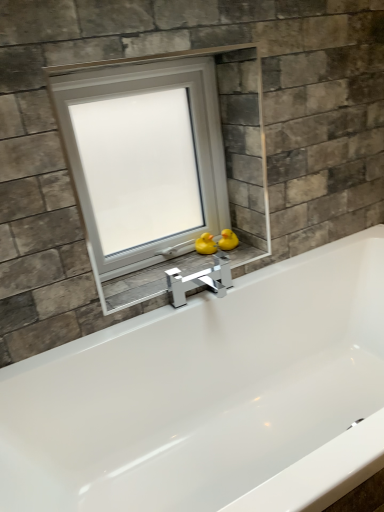
Locate an element on the screen. The height and width of the screenshot is (512, 384). white plastic window at center is located at coordinates (145, 160).

What is the approximate height of yellow rubber duck at center, acting as the 2th duck starting from the left?

yellow rubber duck at center, acting as the 2th duck starting from the left, is 3.41 inches tall.

What are the coordinates of `white plastic window at center` in the screenshot? It's located at (145, 160).

From a real-world perspective, starting from the matte gray stone at center, which duck is the 1st one vertically above it? Please provide its 2D coordinates.

[(206, 244)]

Can yellow rubber duck at center, acting as the 1th duck starting from the left, be found inside matte gray stone at center?

No, yellow rubber duck at center, acting as the 1th duck starting from the left, is not a part of matte gray stone at center.

Does matte gray stone at center come in front of yellow rubber duck at center, which is the 2th duck from right to left?

Yes, the depth of matte gray stone at center is less than that of yellow rubber duck at center, which is the 2th duck from right to left.

From a real-world perspective, which is physically above, matte gray stone at center or yellow rubber duck at center, acting as the 1th duck starting from the left?

yellow rubber duck at center, acting as the 1th duck starting from the left, from a real-world perspective.

From the image's perspective, is yellow rubber duck at center, which is the 2th duck from right to left, on white plastic window at center?

No, from the image's perspective, yellow rubber duck at center, which is the 2th duck from right to left, is not over white plastic window at center.

Considering the positions of objects yellow rubber duck at center, which is the 2th duck from right to left, and white plastic window at center in the image provided, who is in front, yellow rubber duck at center, which is the 2th duck from right to left, or white plastic window at center?

white plastic window at center is in front.

Which object is positioned more to the left, yellow rubber duck at center, acting as the 1th duck starting from the left, or white plastic window at center?

Positioned to the left is white plastic window at center.

Is yellow rubber duck at center, which is the 2th duck from right to left, bigger than white plastic window at center?

No.

Is white plastic window at center shorter than matte gray stone at center?

Incorrect, the height of white plastic window at center does not fall short of that of matte gray stone at center.

Could you tell me if white plastic window at center is turned towards matte gray stone at center?

Yes, white plastic window at center is oriented towards matte gray stone at center.

Is white plastic window at center at the left side of matte gray stone at center?

Yes, white plastic window at center is to the left of matte gray stone at center.

Does yellow rubber duck at center, the first duck viewed from the right, have a smaller size compared to yellow rubber duck at center, which is the 2th duck from right to left?

Actually, yellow rubber duck at center, the first duck viewed from the right, might be larger than yellow rubber duck at center, which is the 2th duck from right to left.

Can you see yellow rubber duck at center, acting as the 2th duck starting from the left, touching yellow rubber duck at center, which is the 2th duck from right to left?

Yes, yellow rubber duck at center, acting as the 2th duck starting from the left, is beside yellow rubber duck at center, which is the 2th duck from right to left.

Which of these two, yellow rubber duck at center, the first duck viewed from the right, or yellow rubber duck at center, which is the 2th duck from right to left, stands shorter?

yellow rubber duck at center, the first duck viewed from the right.

The width and height of the screenshot is (384, 512). Identify the location of duck that is above the yellow rubber duck at center, acting as the 1th duck starting from the left (from a real-world perspective). coord(228,240).

Is white plastic window at center situated inside yellow rubber duck at center, acting as the 1th duck starting from the left, or outside?

white plastic window at center lies outside yellow rubber duck at center, acting as the 1th duck starting from the left.

Considering the positions of objects white plastic window at center and yellow rubber duck at center, which is the 2th duck from right to left, in the image provided, who is more to the left, white plastic window at center or yellow rubber duck at center, which is the 2th duck from right to left,?

white plastic window at center.

Is white plastic window at center bigger than yellow rubber duck at center, which is the 2th duck from right to left?

Yes.

Can you confirm if white plastic window at center is thinner than yellow rubber duck at center, acting as the 1th duck starting from the left?

In fact, white plastic window at center might be wider than yellow rubber duck at center, acting as the 1th duck starting from the left.

From the image's perspective, relative to yellow rubber duck at center, the first duck viewed from the right, is yellow rubber duck at center, acting as the 1th duck starting from the left, above or below?

Based on their image positions, yellow rubber duck at center, acting as the 1th duck starting from the left, is located beneath yellow rubber duck at center, the first duck viewed from the right.

Considering the sizes of yellow rubber duck at center, which is the 2th duck from right to left, and yellow rubber duck at center, the first duck viewed from the right, in the image, is yellow rubber duck at center, which is the 2th duck from right to left, taller or shorter than yellow rubber duck at center, the first duck viewed from the right,?

yellow rubber duck at center, which is the 2th duck from right to left, is taller than yellow rubber duck at center, the first duck viewed from the right.

Is point (205, 242) behind point (227, 244)?

Yes, it is.

Can you confirm if yellow rubber duck at center, acting as the 1th duck starting from the left, is positioned to the right of yellow rubber duck at center, acting as the 2th duck starting from the left?

No, yellow rubber duck at center, acting as the 1th duck starting from the left, is not to the right of yellow rubber duck at center, acting as the 2th duck starting from the left.

Does yellow rubber duck at center, which is the 2th duck from right to left, touch matte gray stone at center?

No.

Is matte gray stone at center surrounded by yellow rubber duck at center, acting as the 1th duck starting from the left?

No, matte gray stone at center is not a part of yellow rubber duck at center, acting as the 1th duck starting from the left.

How different are the orientations of yellow rubber duck at center, acting as the 1th duck starting from the left, and matte gray stone at center in degrees?

2.65 degrees.

Is yellow rubber duck at center, acting as the 1th duck starting from the left, positioned with its back to matte gray stone at center?

yellow rubber duck at center, acting as the 1th duck starting from the left, is not turned away from matte gray stone at center.

The image size is (384, 512). There is a matte gray stone at center. In order to click on the 1st duck above it (from a real-world perspective) in this screenshot , I will do `click(206, 244)`.

Identify the location of the 2nd duck below the white plastic window at center (from the image's perspective). The width and height of the screenshot is (384, 512). (206, 244).

Looking at the image, which one is located further to white plastic window at center, matte gray stone at center or yellow rubber duck at center, acting as the 2th duck starting from the left?

yellow rubber duck at center, acting as the 2th duck starting from the left, is positioned further to the anchor white plastic window at center.

Consider the image. When comparing their distances from yellow rubber duck at center, which is the 2th duck from right to left, does yellow rubber duck at center, the first duck viewed from the right, or white plastic window at center seem closer?

yellow rubber duck at center, the first duck viewed from the right, is closer to yellow rubber duck at center, which is the 2th duck from right to left.

Estimate the real-world distances between objects in this image. Which object is closer to white plastic window at center, yellow rubber duck at center, the first duck viewed from the right, or matte gray stone at center?

matte gray stone at center is closer to white plastic window at center.

Which object lies further to the anchor point white plastic window at center, yellow rubber duck at center, which is the 2th duck from right to left, or yellow rubber duck at center, acting as the 2th duck starting from the left?

yellow rubber duck at center, acting as the 2th duck starting from the left, is further to white plastic window at center.

Based on their spatial positions, is yellow rubber duck at center, acting as the 1th duck starting from the left, or matte gray stone at center closer to white plastic window at center?

matte gray stone at center is closer to white plastic window at center.

Estimate the real-world distances between objects in this image. Which object is closer to matte gray stone at center, yellow rubber duck at center, acting as the 1th duck starting from the left, or white plastic window at center?

yellow rubber duck at center, acting as the 1th duck starting from the left, lies closer to matte gray stone at center than the other object.

Based on their spatial positions, is yellow rubber duck at center, the first duck viewed from the right, or white plastic window at center further from matte gray stone at center?

Based on the image, white plastic window at center appears to be further to matte gray stone at center.

Looking at the image, which one is located further to yellow rubber duck at center, the first duck viewed from the right, white plastic window at center or matte gray stone at center?

Based on the image, white plastic window at center appears to be further to yellow rubber duck at center, the first duck viewed from the right.

Where is `window sill located between white plastic window at center and yellow rubber duck at center, acting as the 2th duck starting from the left, in the depth direction`? Image resolution: width=384 pixels, height=512 pixels. window sill located between white plastic window at center and yellow rubber duck at center, acting as the 2th duck starting from the left, in the depth direction is located at coordinates (151, 280).

Identify the location of duck between white plastic window at center and yellow rubber duck at center, acting as the 2th duck starting from the left, in the front-back direction. (206, 244).

The image size is (384, 512). I want to click on duck between matte gray stone at center and yellow rubber duck at center, the first duck viewed from the right, from front to back, so click(x=206, y=244).